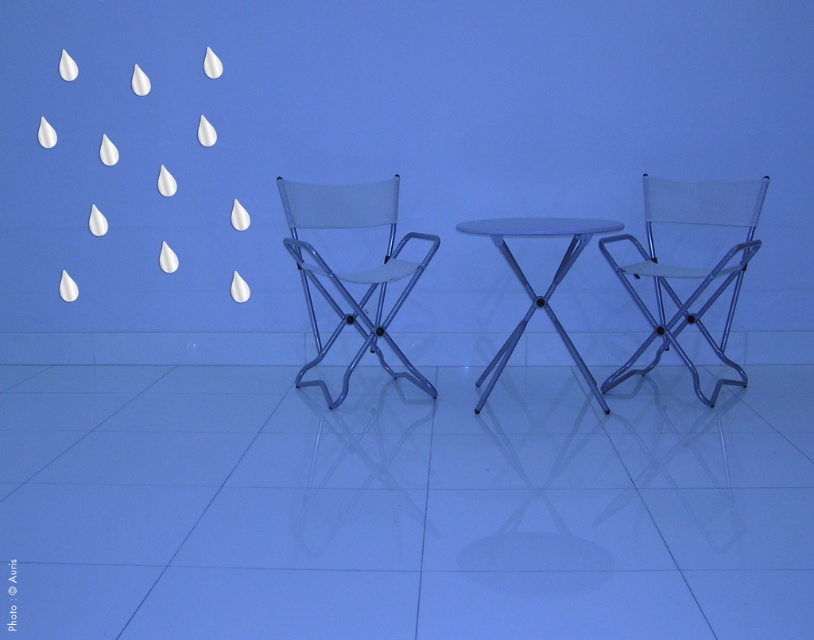
Who is more forward, (x=302, y=188) or (x=550, y=220)?

Positioned in front is point (x=550, y=220).

This screenshot has width=814, height=640. In order to click on white fabric chair at center in this screenshot , I will do `click(351, 273)`.

Between point (340, 314) and point (493, 380), which one is positioned in front?

Point (493, 380)

Find the location of `white fabric chair at center`. white fabric chair at center is located at coordinates (351, 273).

Is translucent plastic chair at right positioned at the back of metallic silver table at center?

Yes, it is.

Looking at this image, is translucent plastic chair at right wider than metallic silver table at center?

Yes, translucent plastic chair at right is wider than metallic silver table at center.

This screenshot has width=814, height=640. I want to click on translucent plastic chair at right, so click(x=689, y=268).

Where is `translucent plastic chair at right`? Image resolution: width=814 pixels, height=640 pixels. translucent plastic chair at right is located at coordinates (689, 268).

Is translucent plastic chair at right thinner than white fabric chair at center?

No, translucent plastic chair at right is not thinner than white fabric chair at center.

Which is below, translucent plastic chair at right or white fabric chair at center?

Positioned lower is translucent plastic chair at right.

Which is in front, point (681, 214) or point (338, 323)?

Point (338, 323)

The image size is (814, 640). What are the coordinates of `translucent plastic chair at right` in the screenshot? It's located at (689, 268).